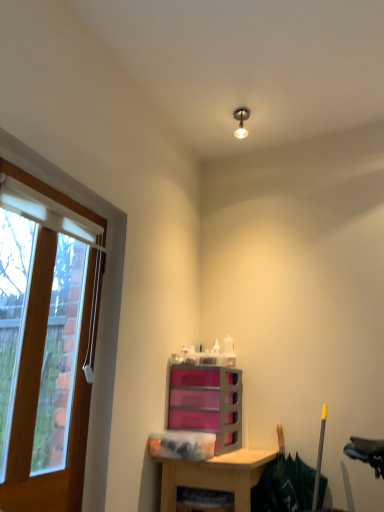
What do you see at coordinates (241, 121) in the screenshot? Image resolution: width=384 pixels, height=512 pixels. I see `metallic bulb at upper center` at bounding box center [241, 121].

Find the location of `metallic bulb at upper center`. metallic bulb at upper center is located at coordinates (241, 121).

Measure the distance between point (48,276) and camera.

A distance of 1.78 meters exists between point (48,276) and camera.

Find the location of `metallic bulb at upper center`. metallic bulb at upper center is located at coordinates (241, 121).

Can we say wooden frame at left lies outside metallic bulb at upper center?

wooden frame at left lies outside metallic bulb at upper center's area.

Considering the sizes of wooden frame at left and metallic bulb at upper center in the image, is wooden frame at left wider or thinner than metallic bulb at upper center?

wooden frame at left is thinner than metallic bulb at upper center.

Looking at this image, between wooden frame at left and metallic bulb at upper center, which one has larger size?

wooden frame at left is bigger.

Is wooden frame at left next to metallic bulb at upper center?

wooden frame at left is not next to metallic bulb at upper center, and they're not touching.

Does point (53, 206) appear closer or farther from the camera than point (216, 443)?

Point (53, 206).

Identify the location of window located on the left of pink plastic drawers at center. Image resolution: width=384 pixels, height=512 pixels. pos(46,347).

From the picture: Which object is positioned more to the right, wooden frame at left or pink plastic drawers at center?

pink plastic drawers at center.

Is wooden frame at left oriented towards pink plastic drawers at center?

No, wooden frame at left is not turned towards pink plastic drawers at center.

Where is `light fixture above the wooden desk at lower center (from the image's perspective)`? This screenshot has height=512, width=384. light fixture above the wooden desk at lower center (from the image's perspective) is located at coordinates (241, 121).

Between wooden desk at lower center and metallic bulb at upper center, which one has more height?

wooden desk at lower center is taller.

Would you say wooden desk at lower center is a long distance from metallic bulb at upper center?

wooden desk at lower center is far away from metallic bulb at upper center.

Is metallic bulb at upper center to the right of pink plastic drawers at center from the viewer's perspective?

Yes, metallic bulb at upper center is to the right of pink plastic drawers at center.

Is metallic bulb at upper center further to camera compared to pink plastic drawers at center?

Yes, metallic bulb at upper center is further from the camera.

From the image's perspective, is metallic bulb at upper center positioned above or below pink plastic drawers at center?

Based on their image positions, metallic bulb at upper center is located above pink plastic drawers at center.

In terms of height, does metallic bulb at upper center look taller or shorter compared to pink plastic drawers at center?

Considering their sizes, metallic bulb at upper center has less height than pink plastic drawers at center.

From the image's perspective, which object appears higher, wooden frame at left or wooden desk at lower center?

wooden frame at left appears higher in the image.

Is wooden frame at left oriented away from wooden desk at lower center?

No, wooden desk at lower center is not at the back of wooden frame at left.

Are wooden frame at left and wooden desk at lower center beside each other?

No, wooden frame at left is not in contact with wooden desk at lower center.

Which object is wider, wooden frame at left or wooden desk at lower center?

wooden desk at lower center is wider.

Is pink plastic drawers at center turned away from wooden desk at lower center?

No, pink plastic drawers at center is not facing away from wooden desk at lower center.

Is point (175, 402) closer or farther from the camera than point (232, 458)?

Point (175, 402) is farther from the camera than point (232, 458).

Which object is closer to the camera, pink plastic drawers at center or wooden desk at lower center?

wooden desk at lower center is closer to the camera.

From the image's perspective, between pink plastic drawers at center and wooden desk at lower center, which one is located above?

pink plastic drawers at center is shown above in the image.

Where is `light fixture that is above the wooden desk at lower center (from a real-world perspective)`? The height and width of the screenshot is (512, 384). light fixture that is above the wooden desk at lower center (from a real-world perspective) is located at coordinates (241, 121).

From a real-world perspective, is metallic bulb at upper center positioned under wooden desk at lower center based on gravity?

No.

Between metallic bulb at upper center and wooden desk at lower center, which one appears on the left side from the viewer's perspective?

wooden desk at lower center.

Locate an element on the screen. This screenshot has height=512, width=384. light fixture above the wooden frame at left (from the image's perspective) is located at coordinates click(x=241, y=121).

Find the location of a particular element. Image resolution: width=384 pixels, height=512 pixels. cabinetry that is below the wooden frame at left (from the image's perspective) is located at coordinates (207, 403).

Based on their spatial positions, is wooden desk at lower center or pink plastic drawers at center further from wooden frame at left?

Based on the image, pink plastic drawers at center appears to be further to wooden frame at left.

Looking at the image, which one is located further to pink plastic drawers at center, wooden desk at lower center or metallic bulb at upper center?

metallic bulb at upper center.

Which object lies nearer to the anchor point metallic bulb at upper center, pink plastic drawers at center or wooden frame at left?

wooden frame at left lies closer to metallic bulb at upper center than the other object.

When comparing their distances from pink plastic drawers at center, does wooden frame at left or metallic bulb at upper center seem closer?

wooden frame at left is positioned closer to the anchor pink plastic drawers at center.

Looking at the image, which one is located further to metallic bulb at upper center, wooden frame at left or pink plastic drawers at center?

pink plastic drawers at center is positioned further to the anchor metallic bulb at upper center.

From the image, which object appears to be farther from wooden frame at left, metallic bulb at upper center or pink plastic drawers at center?

Among the two, metallic bulb at upper center is located further to wooden frame at left.

Based on their spatial positions, is wooden desk at lower center or pink plastic drawers at center closer to metallic bulb at upper center?

pink plastic drawers at center lies closer to metallic bulb at upper center than the other object.

From the image, which object appears to be farther from wooden desk at lower center, pink plastic drawers at center or wooden frame at left?

Among the two, wooden frame at left is located further to wooden desk at lower center.

Where is `cabinetry that lies between metallic bulb at upper center and wooden desk at lower center from top to bottom`? cabinetry that lies between metallic bulb at upper center and wooden desk at lower center from top to bottom is located at coordinates (207, 403).

Where is `window between metallic bulb at upper center and pink plastic drawers at center vertically`? The height and width of the screenshot is (512, 384). window between metallic bulb at upper center and pink plastic drawers at center vertically is located at coordinates (46, 347).

This screenshot has height=512, width=384. Identify the location of window that lies between metallic bulb at upper center and wooden desk at lower center from top to bottom. (46, 347).

Where is `desk positioned between wooden frame at left and pink plastic drawers at center from near to far`? desk positioned between wooden frame at left and pink plastic drawers at center from near to far is located at coordinates (215, 475).